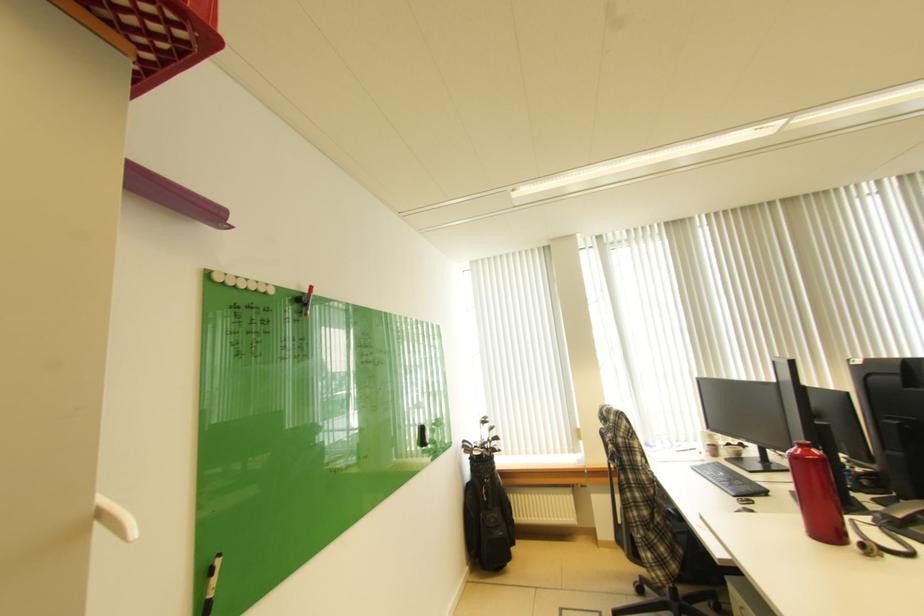
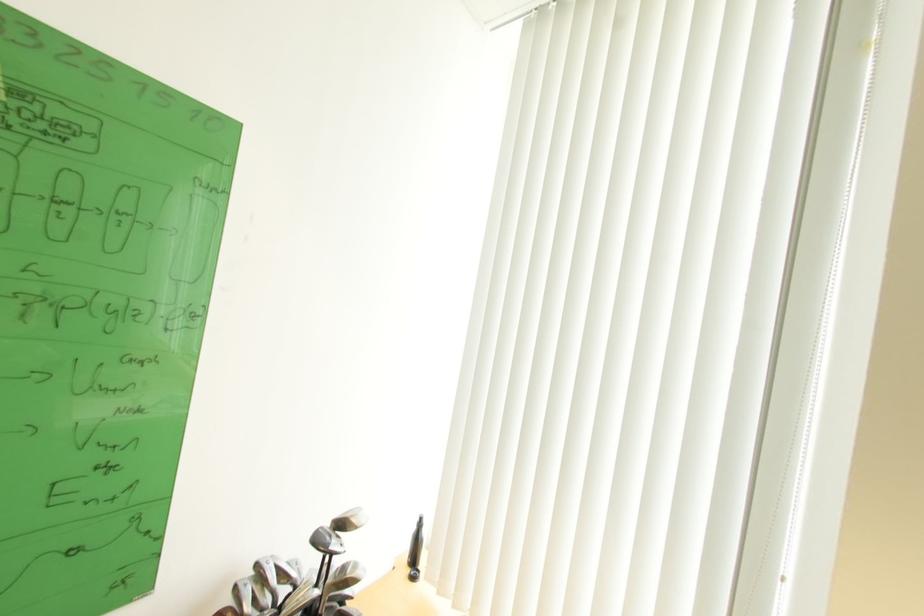
Question: The images are taken continuously from a first-person perspective. In which direction are you moving?

Choices:
 (A) Left
 (B) Right
 (C) Forward
 (D) Backward

Answer: (C)